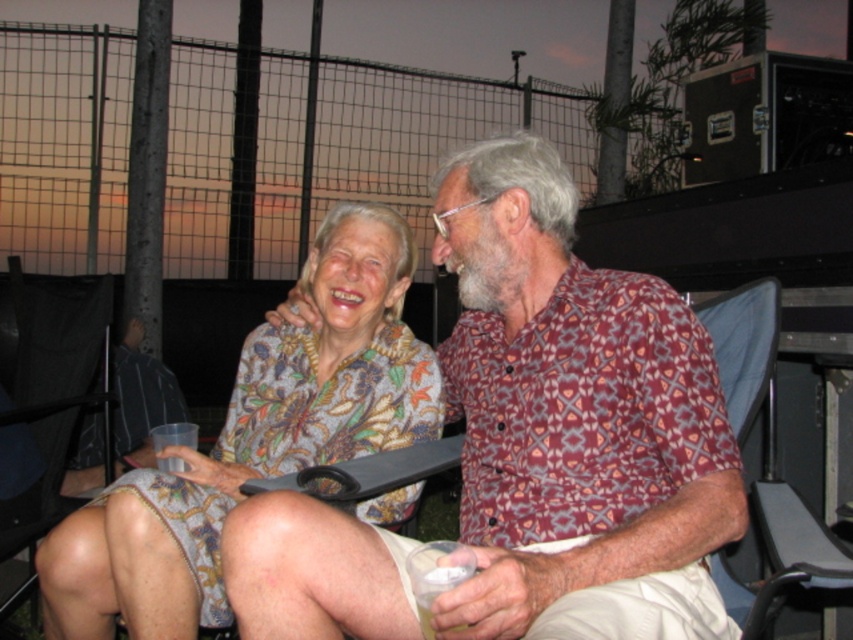
What is the exact coordinate of the blue fabric beach chair at right?

The blue fabric beach chair at right is located at point (x=764, y=461).

You are standing at point (253, 442) in the image. What object is located exactly at this point?

The floral patterned dress at center is located exactly at point (253, 442).